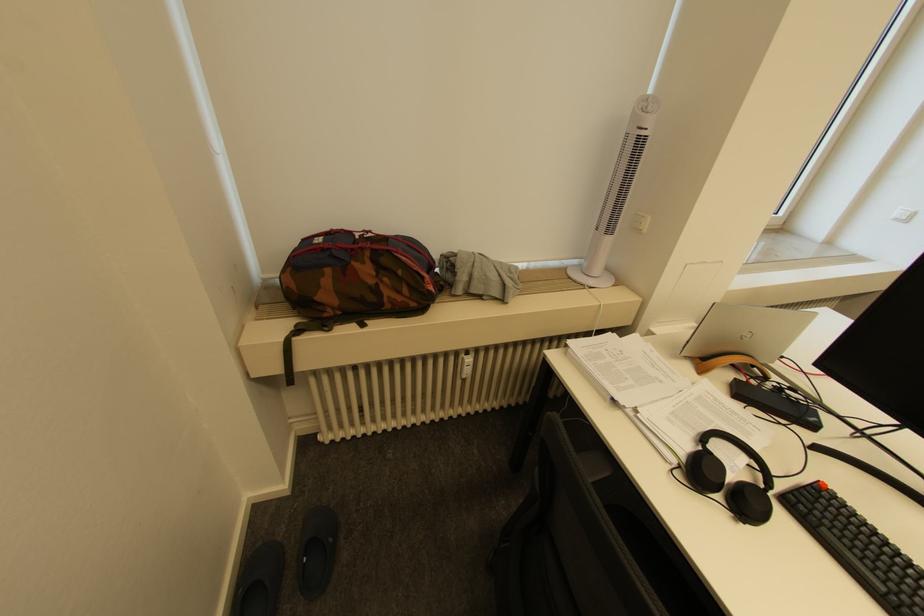
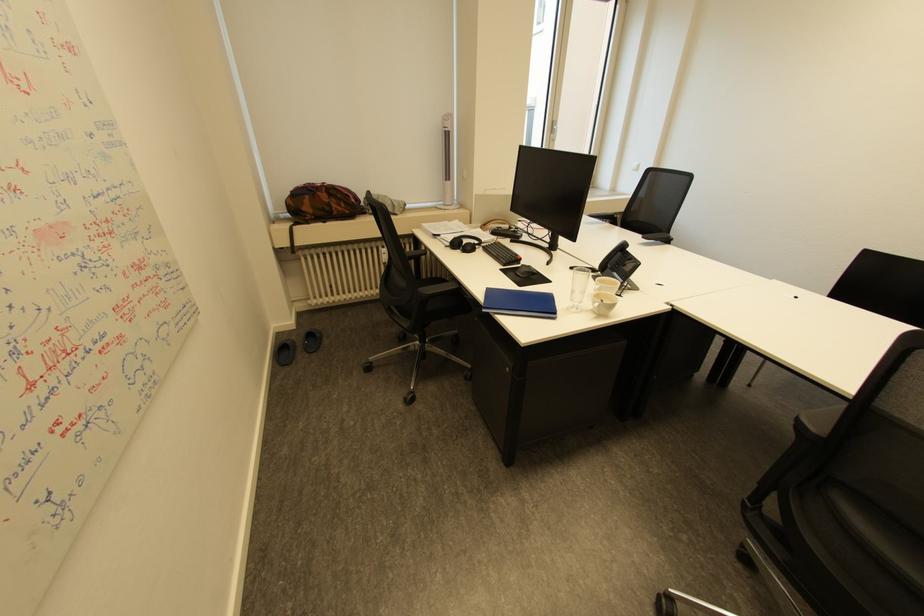
Locate, in the second image, the point that corresponds to (x=441, y=262) in the first image.

(367, 200)